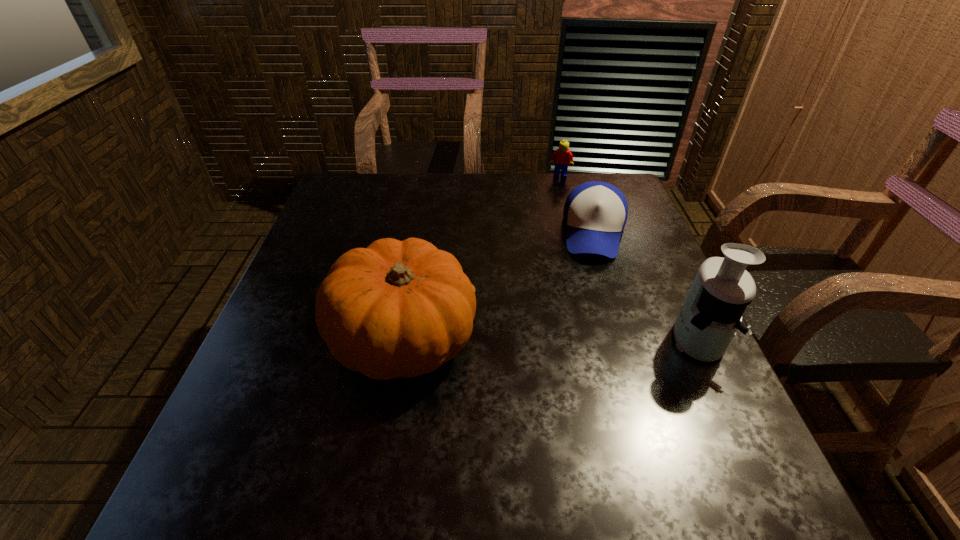
Where is `the third shortest object`? This screenshot has width=960, height=540. the third shortest object is located at coordinates coord(395,309).

Image resolution: width=960 pixels, height=540 pixels. Find the location of `pumpkin`. pumpkin is located at coordinates (395, 309).

Locate an element on the screen. juicer is located at coordinates click(712, 312).

The height and width of the screenshot is (540, 960). I want to click on Lego, so click(x=562, y=157).

You are a GUI agent. You are given a task and a screenshot of the screen. Output one action in this format:
    pyautogui.click(x=<x>, y=<y>)
    Task: Click on the third nearest object
    The height and width of the screenshot is (540, 960).
    Given the screenshot: What is the action you would take?
    pyautogui.click(x=595, y=213)

The width and height of the screenshot is (960, 540). I want to click on vacant space situated on the back of the second tallest object, so click(427, 198).

Where is `free space located 0.160m on the left of the tallest object`? Image resolution: width=960 pixels, height=540 pixels. free space located 0.160m on the left of the tallest object is located at coordinates (590, 339).

The image size is (960, 540). Find the location of `blank area located 0.100m on the front-facing side of the Lego`. blank area located 0.100m on the front-facing side of the Lego is located at coordinates (561, 195).

Find the location of a particular element. Image resolution: width=960 pixels, height=540 pixels. vacant space located 0.140m on the front-facing side of the Lego is located at coordinates (561, 202).

This screenshot has height=540, width=960. Identify the location of free space located on the front-facing side of the Lego. point(562,208).